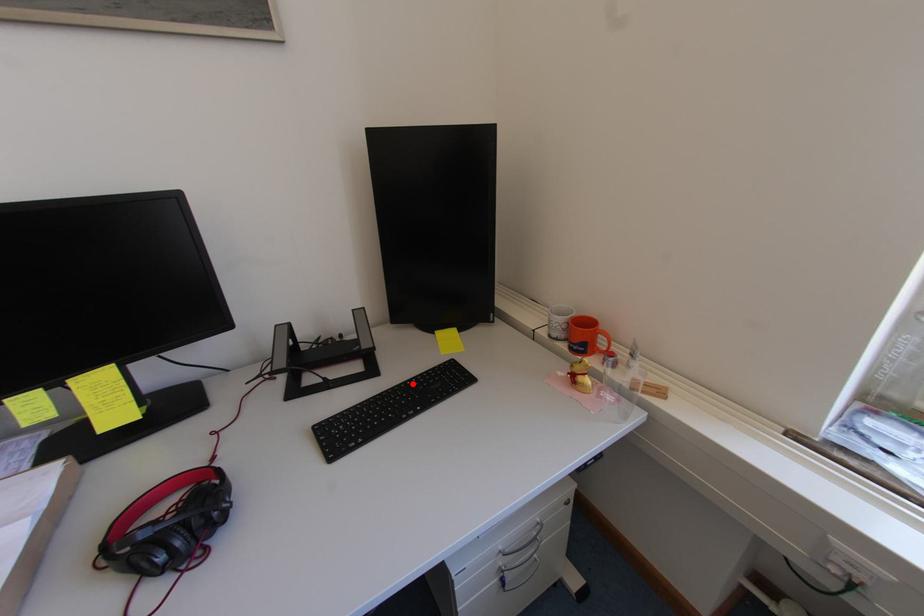
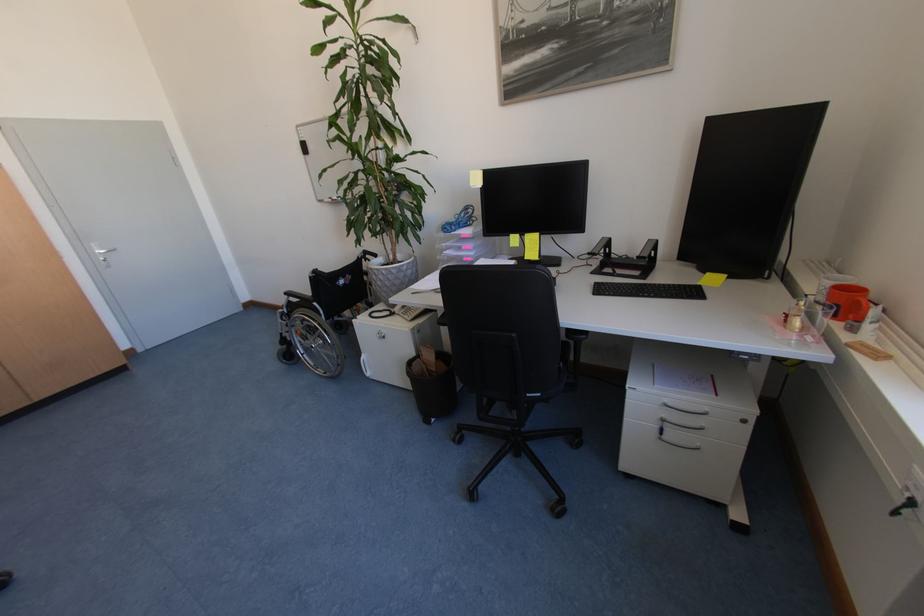
Question: I am providing you with two images of the same scene from different viewpoints. A red point is shown in image1. For the corresponding object point in image2, is it positioned nearer or farther from the camera?

Choices:
 (A) Nearer
 (B) Farther

Answer: (A)